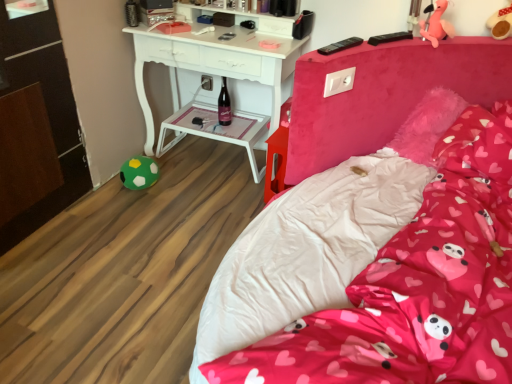
Locate an element on the screen. empty space that is ontop of white plastic side table at center is located at coordinates (216, 124).